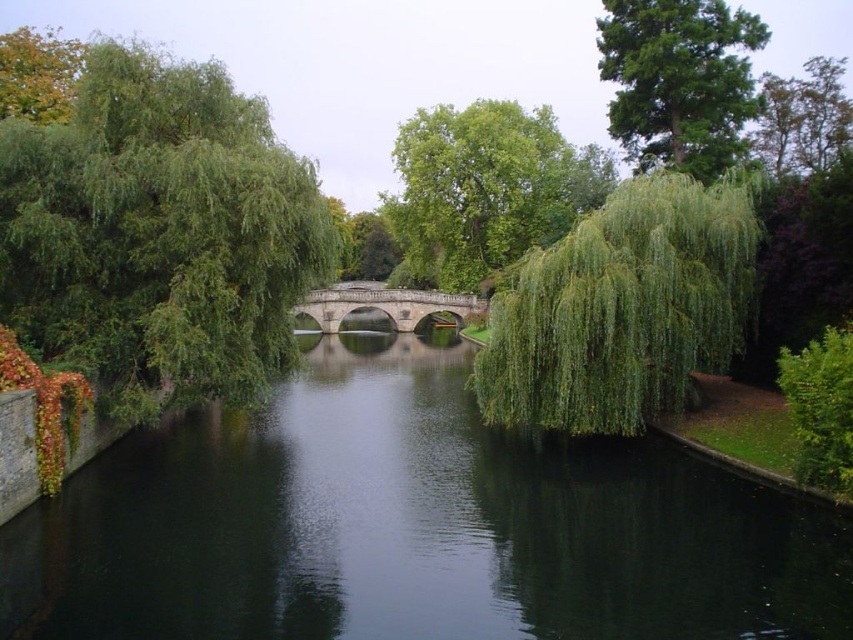
You are an artist planning to paint the scene. You want to ensure the green smooth water at center and the green leafy tree at upper left are proportionally accurate. Which object should you paint to be wider in your artwork?

The green leafy tree at upper left should be painted wider because the green smooth water at center has a lesser width compared to green leafy tree at upper left.

You are standing at the edge of the river and want to reach the point marked as point (612, 48). Considering the river is 120 feet wide, can you safely cross it to reach that point?

The point (612, 48) is 144.32 feet away from the viewer, which is beyond the river width of 120 feet. Therefore, you cannot safely cross the river to reach that point.

You are standing on the stone bridge with three arches on the left side of the river. You want to take a photo of the green leafy tree at upper left and the green smooth water at center. Which object should you point your camera towards first if you want to capture both in one shot?

You should point your camera towards the green leafy tree at upper left first because the green smooth water at center is to the right of it, so capturing the tree first will allow the water to be included in the same frame to its right.